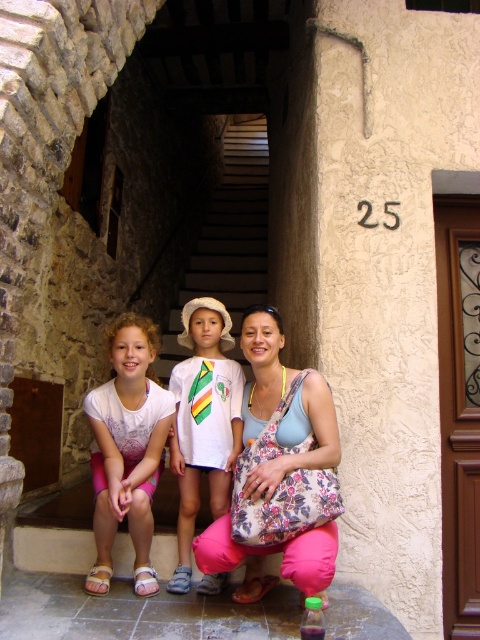
This screenshot has width=480, height=640. Describe the element at coordinates (204, 420) in the screenshot. I see `white cotton shirt at center` at that location.

Does white cotton shirt at center have a greater width compared to white stone stairs at center?

No, white cotton shirt at center is not wider than white stone stairs at center.

Is point (183, 412) positioned in front of point (208, 291)?

Yes.

Identify the location of white cotton shirt at center. Image resolution: width=480 pixels, height=640 pixels. (204, 420).

Who is shorter, floral fabric bag at center or white stone stairs at center?

floral fabric bag at center

Which is behind, point (284, 440) or point (254, 172)?

The point (254, 172) is more distant.

Where is `floral fabric bag at center`? The width and height of the screenshot is (480, 640). floral fabric bag at center is located at coordinates (279, 472).

Can you confirm if floral fabric bag at center is shorter than white cotton shirt at center?

Yes, floral fabric bag at center is shorter than white cotton shirt at center.

Is point (325, 426) less distant than point (177, 381)?

Yes, it is in front of point (177, 381).

Identify the location of floral fabric bag at center. This screenshot has height=640, width=480. (279, 472).